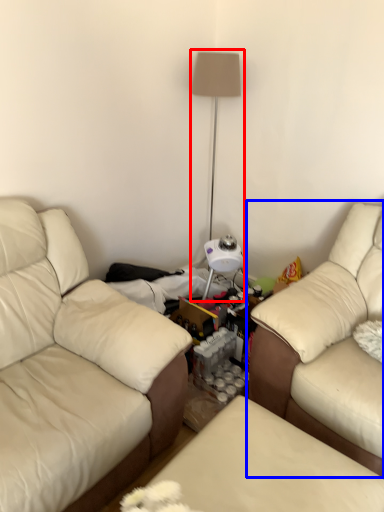
Question: Which of the following is the closest to the observer, table lamp (highlighted by a red box) or studio couch (highlighted by a blue box)?

Choices:
 (A) table lamp
 (B) studio couch

Answer: (B)